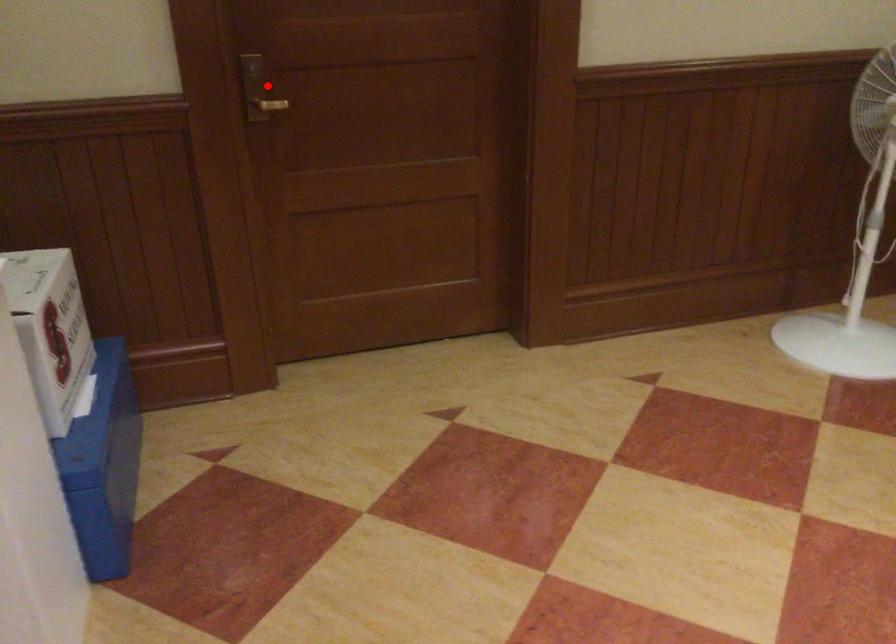
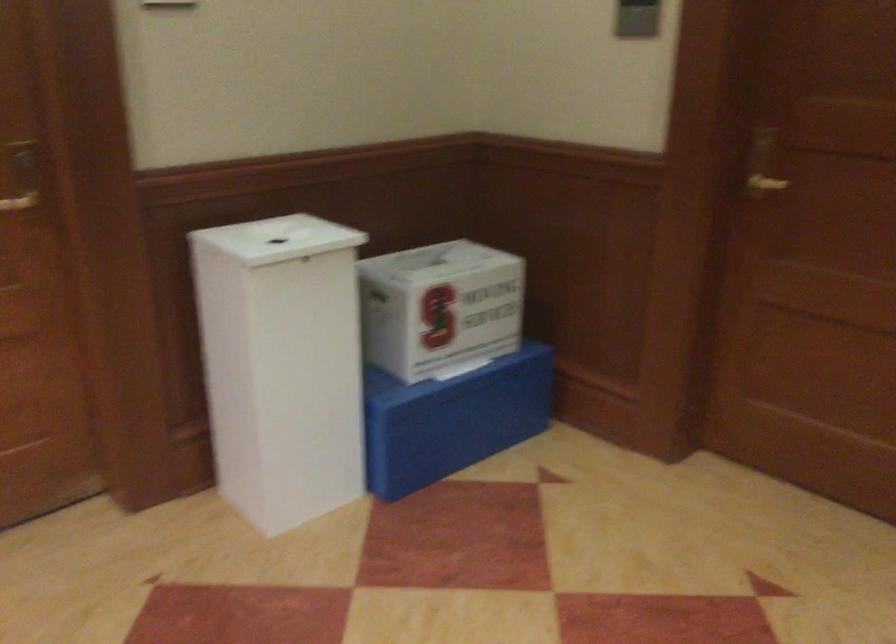
Locate, in the second image, the point that corresponds to the highlighted location in the first image.

(762, 164)